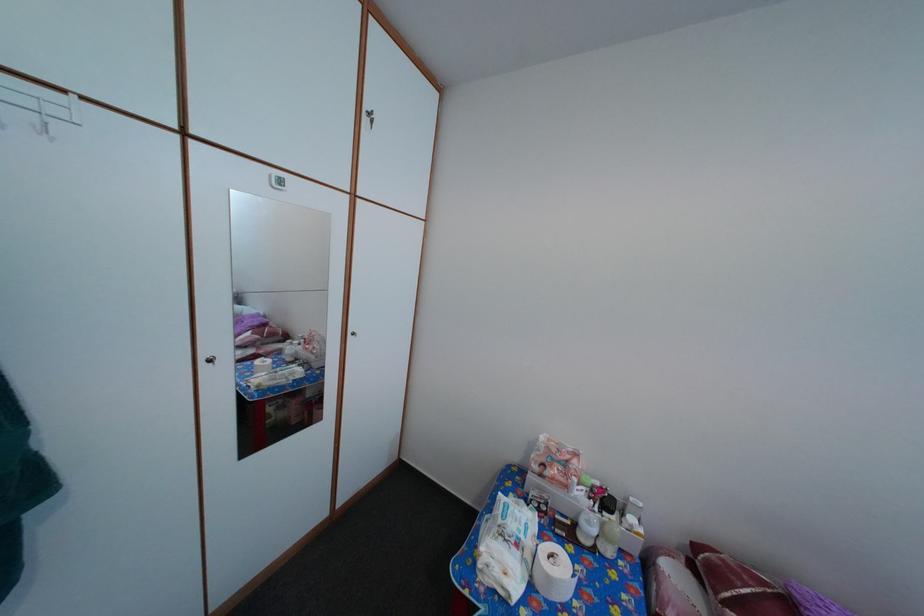
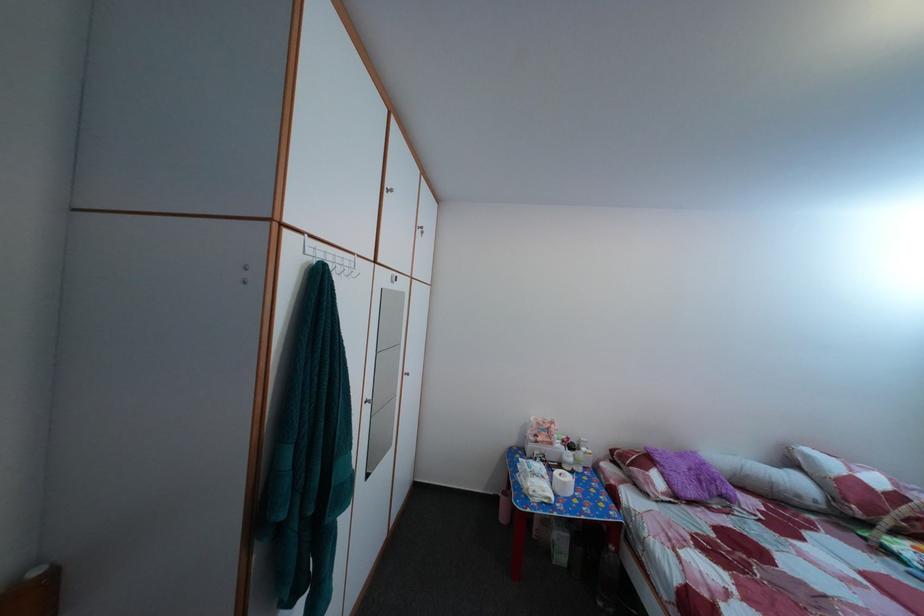
Question: How did the camera likely rotate?

Choices:
 (A) Left
 (B) Right
 (C) Up
 (D) Down

Answer: (B)